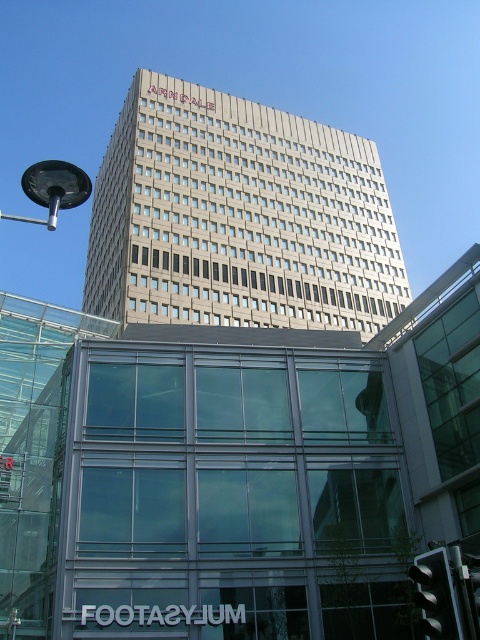
You are a drone operator who needs to fly a drone between the contemporary glass building in the foreground and the beige concrete building at upper center. The drone has a maximum flight distance of 70 meters. Can the drone safely complete this flight without exceeding its range?

The distance between the contemporary glass building in the foreground and the beige concrete building at upper center is 68.22 meters, which is within the drone operator s 70 meter range. Therefore, the drone can safely complete the flight without exceeding its range.

You are standing on the sidewalk in front of the beige concrete building at upper center and want to walk to the black metallic streetlight at upper left. Which direction should you turn to face the streetlight?

Since the beige concrete building at upper center is closer to you than the black metallic streetlight at upper left, you should turn to your left to face the streetlight.